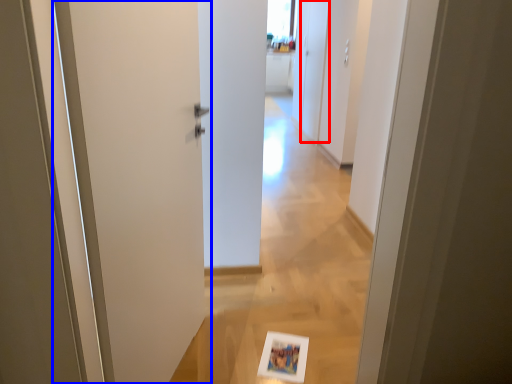
Question: Which object appears farthest to the camera in this image, screen door (highlighted by a red box) or door (highlighted by a blue box)?

Choices:
 (A) screen door
 (B) door

Answer: (A)